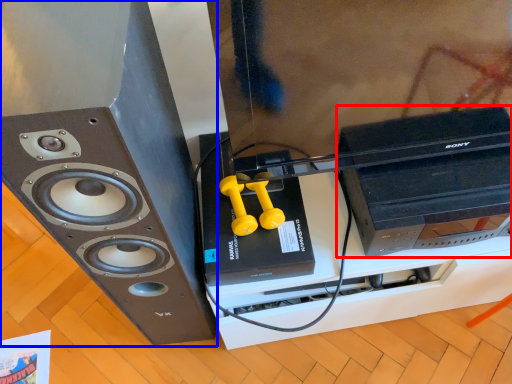
Question: Which of the following is the closest to the observer, computer (highlighted by a red box) or home appliance (highlighted by a blue box)?

Choices:
 (A) computer
 (B) home appliance

Answer: (B)